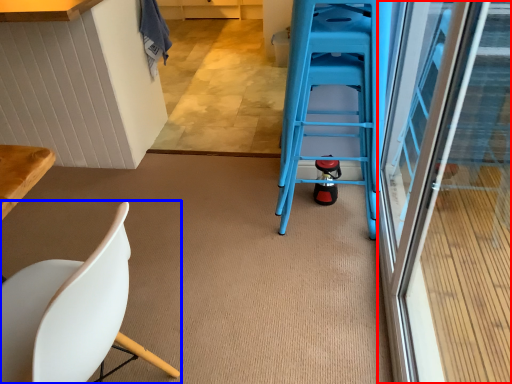
Question: Which of the following is the farthest to the observer, screen door (highlighted by a red box) or chair (highlighted by a blue box)?

Choices:
 (A) screen door
 (B) chair

Answer: (B)